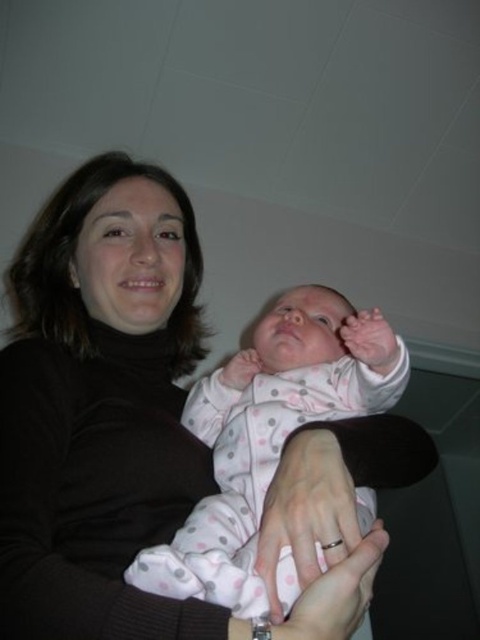
Question: Is matte black sweater at center wider than pink polka dot fabric at center?

Choices:
 (A) no
 (B) yes

Answer: (B)

Question: Is matte black sweater at center wider than pink polka dot fabric at center?

Choices:
 (A) yes
 (B) no

Answer: (A)

Question: In this image, where is matte black sweater at center located relative to pink polka dot fabric at center?

Choices:
 (A) right
 (B) left

Answer: (B)

Question: Which of the following is the farthest from the observer?

Choices:
 (A) (96, 560)
 (B) (239, 570)

Answer: (A)